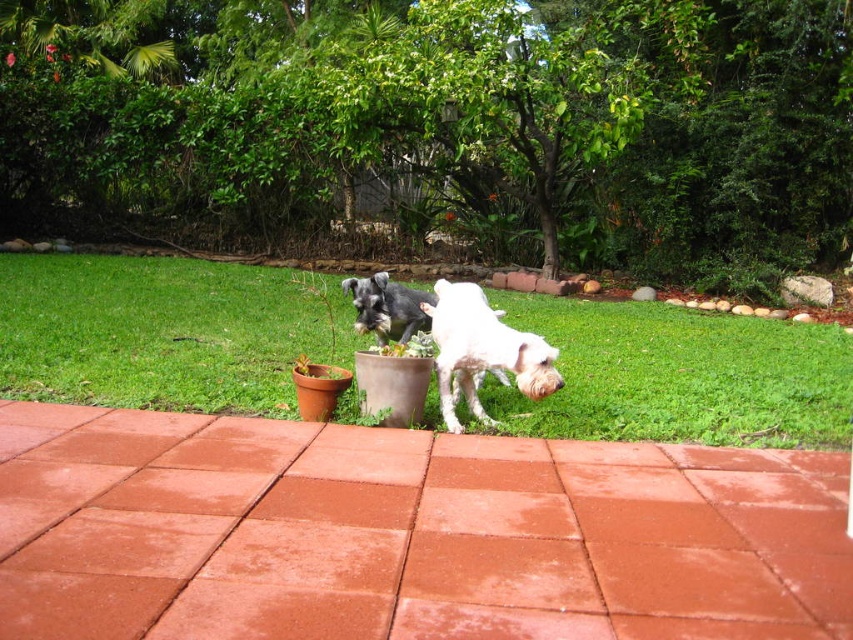
Question: Which point is closer to the camera?

Choices:
 (A) white fur dog at center
 (B) shiny black dog at center

Answer: (A)

Question: Based on their relative distances, which object is farther from the shiny black dog at center?

Choices:
 (A) green grass at center
 (B) white fur dog at center

Answer: (A)

Question: Which point is farther to the camera?

Choices:
 (A) shiny black dog at center
 (B) green grass at center
 (C) white fur dog at center

Answer: (A)

Question: Is white fur dog at center in front of shiny black dog at center?

Choices:
 (A) no
 (B) yes

Answer: (B)

Question: Does green grass at center have a smaller size compared to white fur dog at center?

Choices:
 (A) no
 (B) yes

Answer: (A)

Question: Does white fur dog at center appear under shiny black dog at center?

Choices:
 (A) no
 (B) yes

Answer: (B)